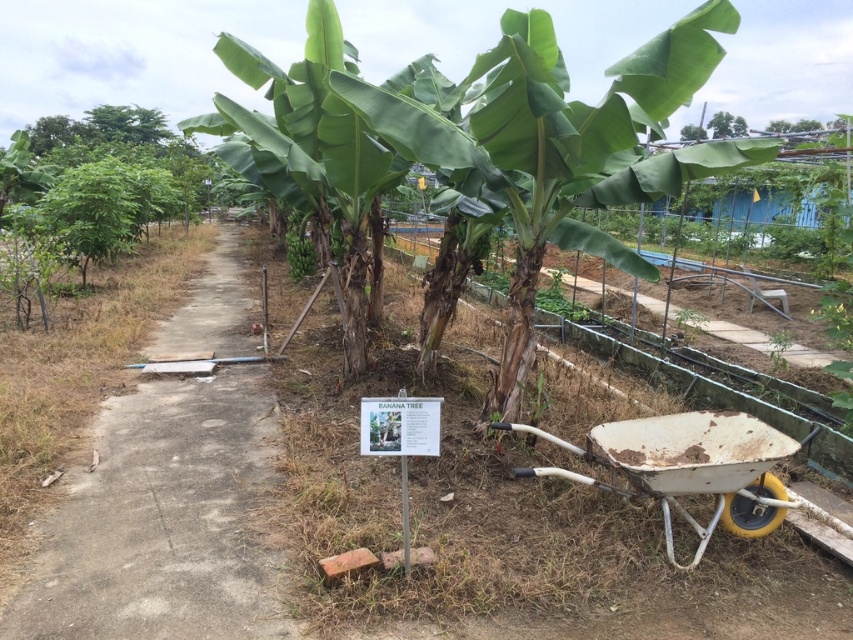
Question: Which of the following is the closest to the observer?

Choices:
 (A) coord(511,276)
 (B) coord(70,513)
 (C) coord(741,477)
 (D) coord(103,145)

Answer: (C)

Question: Is white metal wheelbarrow at lower right below green leafy tree at left?

Choices:
 (A) yes
 (B) no

Answer: (A)

Question: Among these points, which one is farthest from the camera?

Choices:
 (A) (757, 531)
 (B) (51, 131)

Answer: (B)

Question: Does dull concrete path at center appear under green leafy tree at left?

Choices:
 (A) no
 (B) yes

Answer: (B)

Question: Which point is closer to the camera?

Choices:
 (A) green leafy banana tree at center
 (B) white metal wheelbarrow at lower right
 (C) green leafy banana at center

Answer: (B)

Question: Is green leafy tree at upper left closer to the viewer compared to green leafy banana at center?

Choices:
 (A) no
 (B) yes

Answer: (B)